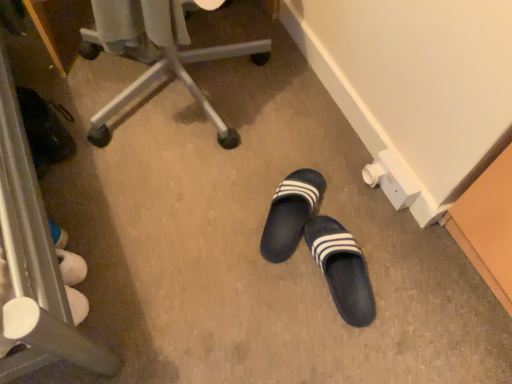
Question: In which direction should I rotate to look at black rubber slippers at center, the second footwear in the right-to-left sequence?

Choices:
 (A) right
 (B) left

Answer: (A)

Question: Can you confirm if black rubber slippers at center, the 2th footwear positioned from the left, is smaller than matte plastic chair at upper center?

Choices:
 (A) yes
 (B) no

Answer: (A)

Question: Is black rubber slippers at center, the 2th footwear positioned from the left, not inside matte plastic chair at upper center?

Choices:
 (A) yes
 (B) no

Answer: (A)

Question: Is black rubber slippers at center, the 2th footwear positioned from the left, facing towards matte plastic chair at upper center?

Choices:
 (A) yes
 (B) no

Answer: (B)

Question: Is black rubber slippers at center, the 2th footwear positioned from the left, closer to camera compared to matte plastic chair at upper center?

Choices:
 (A) no
 (B) yes

Answer: (A)

Question: Is black rubber slippers at center, the 2th footwear positioned from the left, far from matte plastic chair at upper center?

Choices:
 (A) yes
 (B) no

Answer: (B)

Question: Is black rubber slippers at center, the 2th footwear positioned from the left, at the right side of matte plastic chair at upper center?

Choices:
 (A) no
 (B) yes

Answer: (B)

Question: Is black rubber slippers at center, the 2th footwear positioned from the left, outside black rubber slippers at center, the second footwear in the right-to-left sequence?

Choices:
 (A) no
 (B) yes

Answer: (B)

Question: Is black rubber slippers at center, the 1th footwear when ordered from right to left, further to camera compared to black rubber slippers at center, the 1th footwear when ordered from left to right?

Choices:
 (A) no
 (B) yes

Answer: (A)

Question: Is black rubber slippers at center, the 2th footwear positioned from the left, facing away from black rubber slippers at center, the second footwear in the right-to-left sequence?

Choices:
 (A) no
 (B) yes

Answer: (B)

Question: Is black rubber slippers at center, the 2th footwear positioned from the left, with black rubber slippers at center, the 1th footwear when ordered from left to right?

Choices:
 (A) yes
 (B) no

Answer: (B)

Question: Is black rubber slippers at center, the 2th footwear positioned from the left, surrounding black rubber slippers at center, the second footwear in the right-to-left sequence?

Choices:
 (A) yes
 (B) no

Answer: (B)

Question: Does black rubber slippers at center, the 2th footwear positioned from the left, have a smaller size compared to black rubber slippers at center, the second footwear in the right-to-left sequence?

Choices:
 (A) no
 (B) yes

Answer: (B)

Question: Does black rubber slippers at center, the 1th footwear when ordered from left to right, lie behind black rubber slippers at center, the 2th footwear positioned from the left?

Choices:
 (A) no
 (B) yes

Answer: (B)